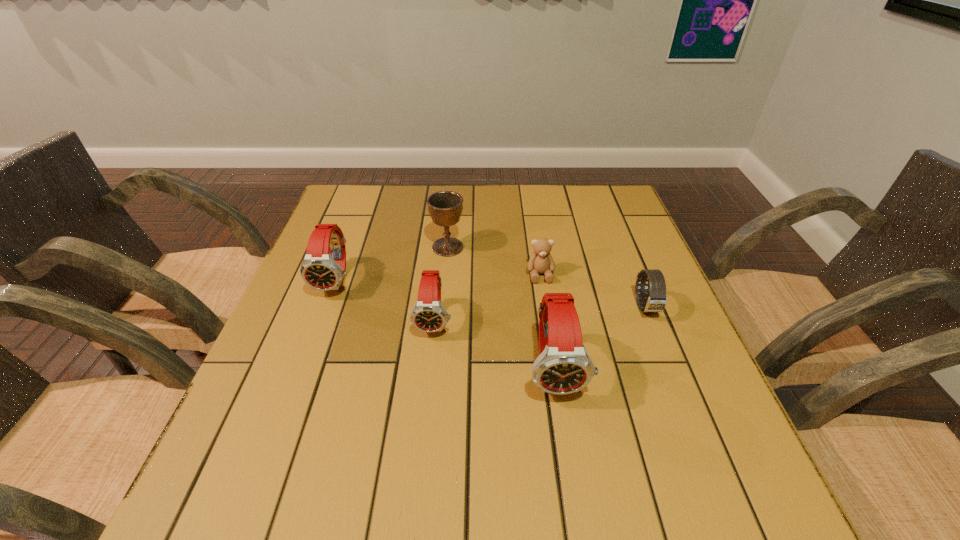
Where is `the leftmost object`? Image resolution: width=960 pixels, height=540 pixels. the leftmost object is located at coordinates (320, 270).

Locate an element on the screen. the leftmost watch is located at coordinates (320, 270).

Image resolution: width=960 pixels, height=540 pixels. In order to click on the fourth tallest object in this screenshot , I will do `click(428, 315)`.

Identify the location of the second shortest watch. (428, 315).

Where is `the second watch from right to left`? The height and width of the screenshot is (540, 960). the second watch from right to left is located at coordinates (563, 366).

Identify the location of teddy bear. The width and height of the screenshot is (960, 540). (541, 261).

Identify the location of the rightmost watch. The width and height of the screenshot is (960, 540). (656, 300).

Image resolution: width=960 pixels, height=540 pixels. What are the coordinates of `the shortest watch` in the screenshot? It's located at (656, 300).

Image resolution: width=960 pixels, height=540 pixels. What are the coordinates of `the farthest object` in the screenshot? It's located at (445, 208).

Find the location of a particular element. The image size is (960, 540). vacant point located 0.050m on the face of the leftmost watch is located at coordinates (324, 317).